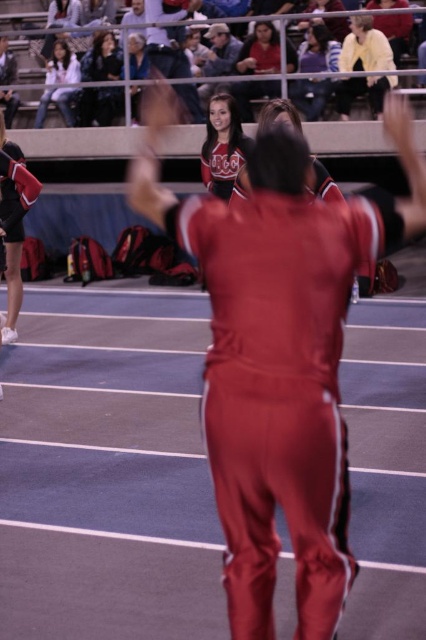
Who is more forward, (242, 65) or (319, 42)?

Positioned in front is point (319, 42).

Is matte red uniform at center to the left of matte black jacket at upper center from the viewer's perspective?

Indeed, matte red uniform at center is positioned on the left side of matte black jacket at upper center.

Between point (235, 97) and point (301, 54), which one is positioned behind?

The point (301, 54) is behind.

Locate an element on the screen. matte red uniform at center is located at coordinates (259, 51).

Does matte black jacket at upper left appear on the left side of matte white jacket at upper left?

In fact, matte black jacket at upper left is to the right of matte white jacket at upper left.

Locate an element on the screen. matte black jacket at upper left is located at coordinates (98, 106).

Measure the distance between matte black jacket at upper left and camera.

The distance of matte black jacket at upper left from camera is 14.53 meters.

Locate an element on the screen. matte black jacket at upper left is located at coordinates coord(98,106).

Between light yellow jacket at upper right and matte red uniform at center, which one is positioned lower?

light yellow jacket at upper right is below.

Describe the element at coordinates (365, 48) in the screenshot. Image resolution: width=426 pixels, height=640 pixels. I see `light yellow jacket at upper right` at that location.

This screenshot has width=426, height=640. Find the location of `light yellow jacket at upper right`. light yellow jacket at upper right is located at coordinates (365, 48).